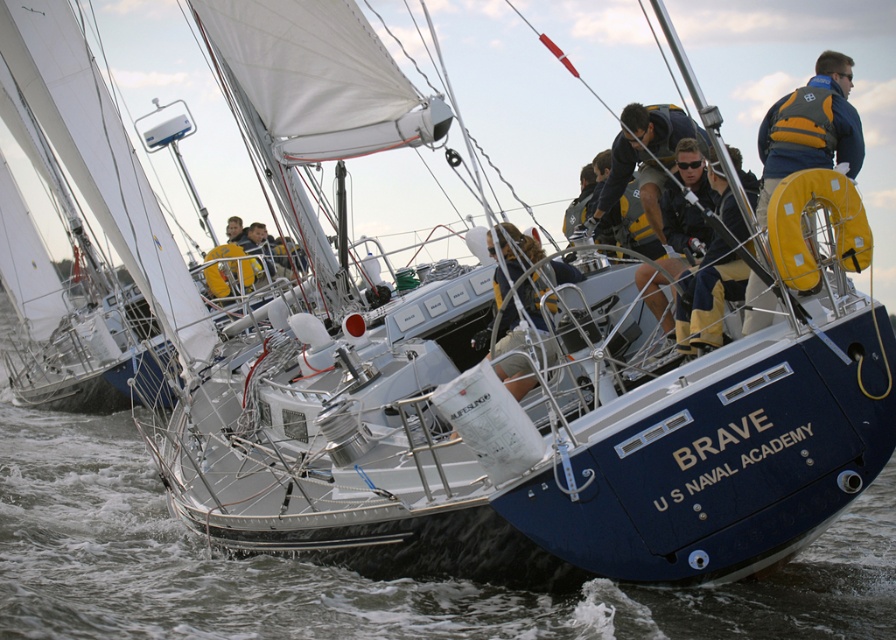
Who is more forward, (0,292) or (533,355)?

Positioned in front is point (533,355).

Is point (702, 621) positioned before point (530, 332)?

Yes, it is.

Which is in front, point (200, 605) or point (507, 266)?

Point (200, 605)

The width and height of the screenshot is (896, 640). In order to click on clear water at lower center in this screenshot , I will do `click(352, 572)`.

The width and height of the screenshot is (896, 640). In order to click on clear water at lower center in this screenshot , I will do `click(352, 572)`.

Is clear water at lower center below yellow life jacket at center?

Indeed, clear water at lower center is positioned under yellow life jacket at center.

Which is behind, point (109, 465) or point (231, 260)?

The point (231, 260) is more distant.

I want to click on clear water at lower center, so click(352, 572).

Who is more distant from viewer, (x=808, y=100) or (x=239, y=269)?

Positioned behind is point (x=239, y=269).

Which is below, yellow fabric life jacket at upper right or yellow life jacket at center?

yellow life jacket at center is lower down.

The width and height of the screenshot is (896, 640). I want to click on yellow fabric life jacket at upper right, so click(x=804, y=120).